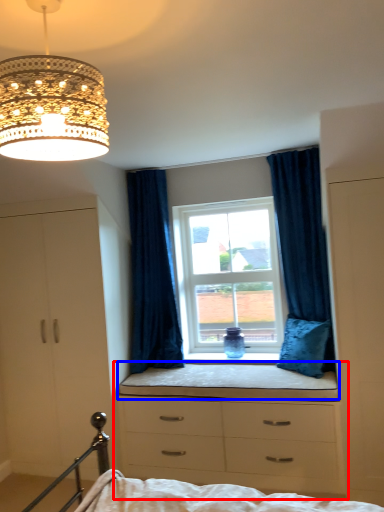
Question: Which of the following is the farthest to the observer, chest of drawers (highlighted by a red box) or window sill (highlighted by a blue box)?

Choices:
 (A) chest of drawers
 (B) window sill

Answer: (B)